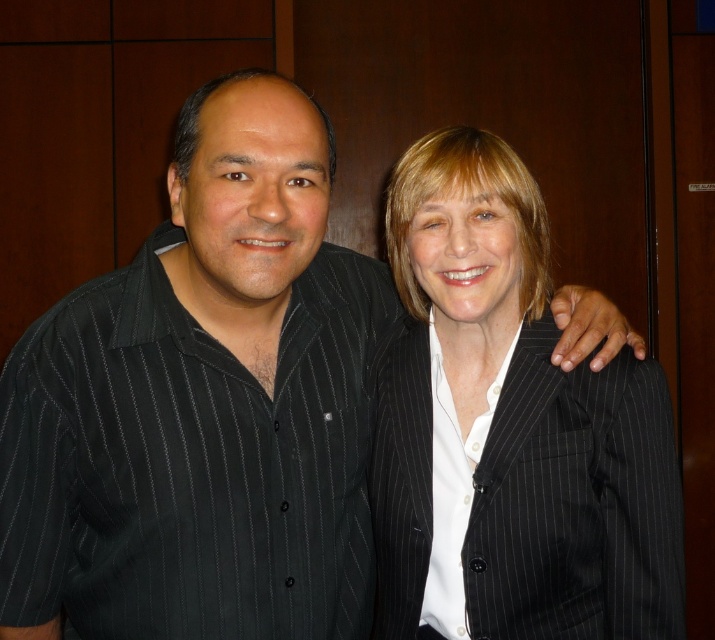
Question: Does black pinstripe suit at right come behind white smooth shirt at center?

Choices:
 (A) no
 (B) yes

Answer: (A)

Question: Can you confirm if black pinstripe suit at right is positioned to the left of white smooth shirt at center?

Choices:
 (A) no
 (B) yes

Answer: (A)

Question: Which of the following is the farthest from the observer?

Choices:
 (A) coord(536,612)
 (B) coord(433,604)

Answer: (B)

Question: Among these objects, which one is nearest to the camera?

Choices:
 (A) black pinstripe suit at right
 (B) white smooth shirt at center

Answer: (A)

Question: Is black pinstripe suit at right to the right of white smooth shirt at center from the viewer's perspective?

Choices:
 (A) yes
 (B) no

Answer: (A)